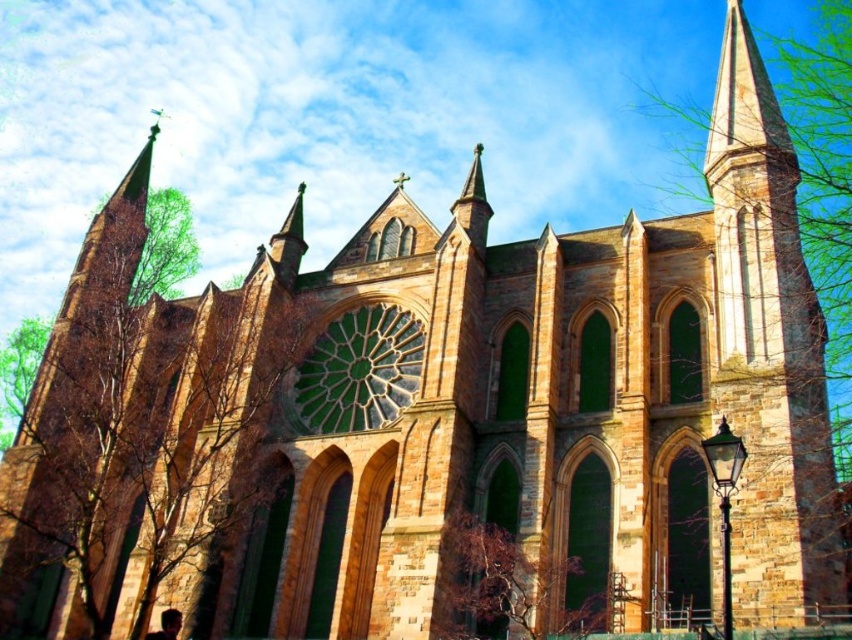
Does point (167, 436) come behind point (473, 528)?

Yes, it is.

Who is positioned more to the right, green leafy tree at left or brown textured tree at lower center?

brown textured tree at lower center is more to the right.

The height and width of the screenshot is (640, 852). I want to click on green leafy tree at left, so click(140, 419).